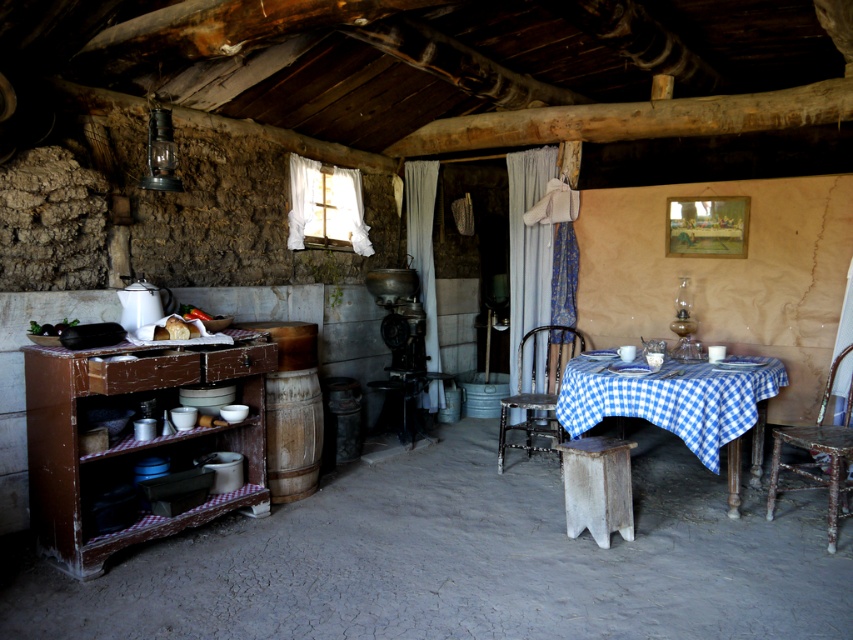
You are standing in the rustic cabin and want to move from the wooden cabinet to the barrel. Which point, point (821,458) or point (525,401), is closer to your starting position at the wooden cabinet?

Point (821,458) is closer to the wooden cabinet because it is in front of point (525,401).

You are sitting on the floor in the middle of the cabin and want to reach a book on a high shelf. There are two chairs available here, a wooden chair at center and a rusty metal chair at center. Which chair should you choose to stand on to reach the book?

The rusty metal chair at center is taller than the wooden chair at center, so you should choose the rusty metal chair at center to stand on to reach the book.

You are standing in the cabin and want to move from the wooden cabinet to the barrel. Which point, point (643, 403) or point (497, 451), is closer to your starting position at the wooden cabinet?

Point (643, 403) is closer to the wooden cabinet because it is in front of point (497, 451), meaning it is nearer to the cabinet.